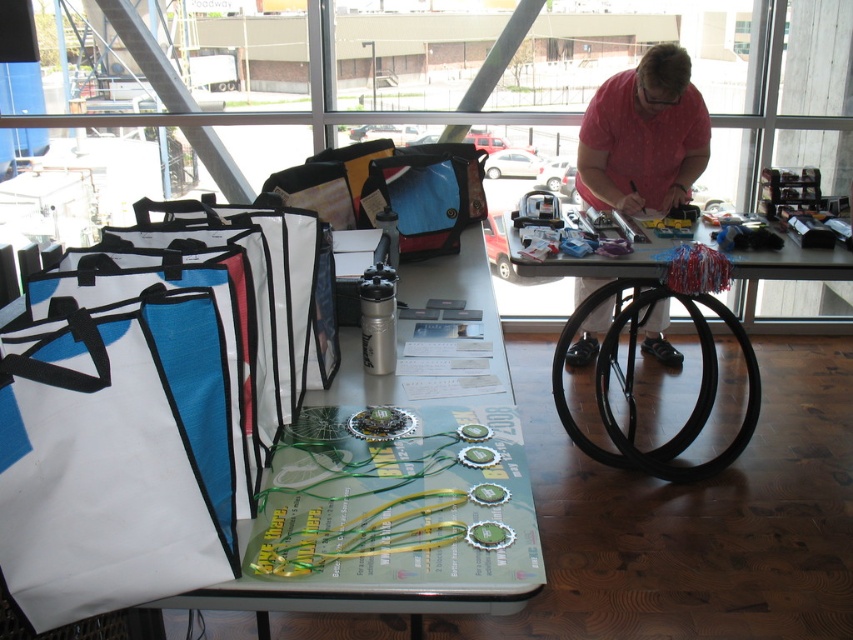
You are organizing an event and need to place a decorative item on the table where the person in the pink shirt is working. The decorative item must be placed exactly at the coordinates point [148,404]. However, there is already an object at that location. What object is currently occupying that spot?

The white non woven tote at left is located at point [148,404].

You are organizing an event and need to know if the white fabric bags at left are closer to the entrance than the pink dotted shirt at upper right. Based on the scene, can you determine this?

The white fabric bags at left are in front of the pink dotted shirt at upper right, which suggests they are closer to the entrance.

You are organizing an event and need to place a decorative centerpiece on the table. Which object should you avoid placing the centerpiece on to ensure it is visible from the entrance? Please choose between the black rubber table at center and the matte blue fabric bag at center.

The matte blue fabric bag at center is positioned to the left of the black rubber table at center. Since the black rubber table at center is on the right side of the bag, placing the centerpiece on the matte blue fabric bag at center would make it more visible from the entrance as it is closer to the left side where the entrance might be assumed based on typical room layouts.